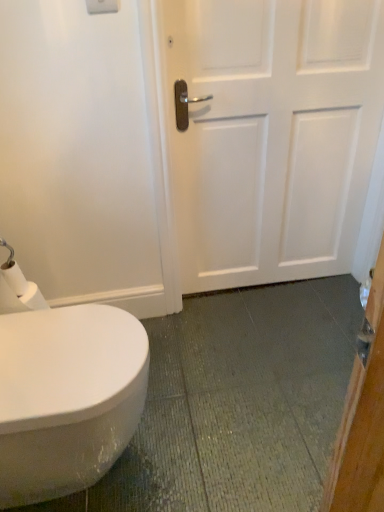
Question: Is white glossy bidet at lower left oriented away from white matte door at center?

Choices:
 (A) no
 (B) yes

Answer: (A)

Question: Is white glossy bidet at lower left at the right side of white matte door at center?

Choices:
 (A) yes
 (B) no

Answer: (B)

Question: Is white glossy bidet at lower left thinner than white matte door at center?

Choices:
 (A) no
 (B) yes

Answer: (A)

Question: Does white glossy bidet at lower left lie behind white matte door at center?

Choices:
 (A) yes
 (B) no

Answer: (B)

Question: Can you confirm if white glossy bidet at lower left is shorter than white matte door at center?

Choices:
 (A) yes
 (B) no

Answer: (A)

Question: Is white glossy bidet at lower left taller or shorter than white matte door at center?

Choices:
 (A) short
 (B) tall

Answer: (A)

Question: Which is correct: white glossy bidet at lower left is inside white matte door at center, or outside of it?

Choices:
 (A) outside
 (B) inside

Answer: (A)

Question: From the image's perspective, relative to white matte door at center, is white glossy bidet at lower left above or below?

Choices:
 (A) above
 (B) below

Answer: (B)

Question: Based on their positions, is white glossy bidet at lower left located to the left or right of white matte door at center?

Choices:
 (A) right
 (B) left

Answer: (B)

Question: From the image's perspective, is white glossy bidet at lower left above or below white matte toilet paper at lower left?

Choices:
 (A) above
 (B) below

Answer: (B)

Question: Looking at their shapes, would you say white glossy bidet at lower left is wider or thinner than white matte toilet paper at lower left?

Choices:
 (A) thin
 (B) wide

Answer: (B)

Question: Considering the positions of white glossy bidet at lower left and white matte toilet paper at lower left in the image, is white glossy bidet at lower left taller or shorter than white matte toilet paper at lower left?

Choices:
 (A) tall
 (B) short

Answer: (A)

Question: Is white glossy bidet at lower left inside the boundaries of white matte toilet paper at lower left, or outside?

Choices:
 (A) outside
 (B) inside

Answer: (A)

Question: Is white matte toilet paper at lower left in front of or behind white matte door at center in the image?

Choices:
 (A) behind
 (B) front

Answer: (B)

Question: From the image's perspective, is white matte toilet paper at lower left above or below white matte door at center?

Choices:
 (A) above
 (B) below

Answer: (B)